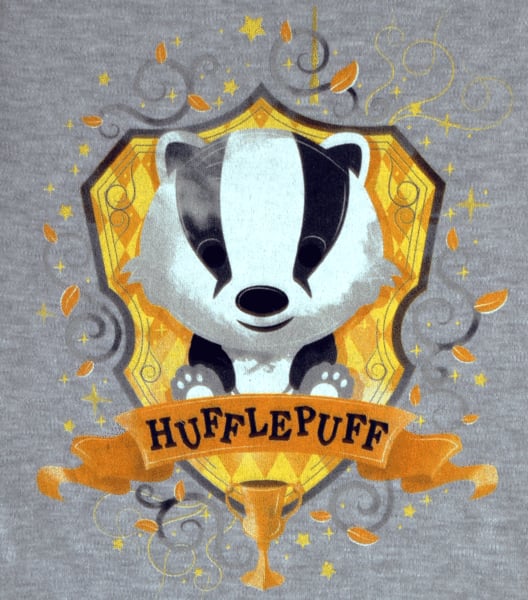
At what (x,y) coordinates should I click in order to perform the action: click on gray background color. Please return your answer as a coordinate pair (x, y). The height and width of the screenshot is (600, 528). Looking at the image, I should click on tap(82, 51).